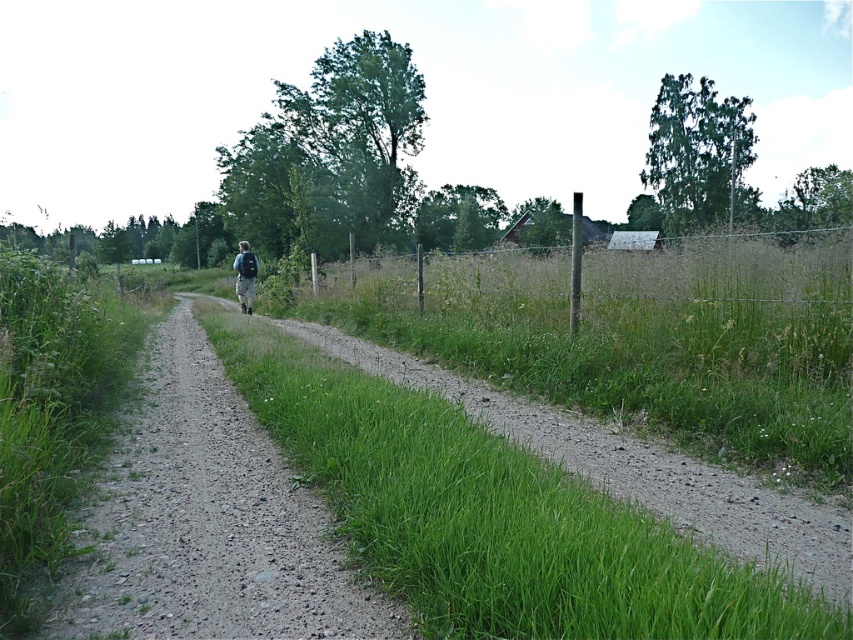
Measure the distance between green wire fence at center and blue backpack at center.

They are 26.31 feet apart.

Is green wire fence at center above blue backpack at center?

Actually, green wire fence at center is below blue backpack at center.

The height and width of the screenshot is (640, 853). What do you see at coordinates (722, 288) in the screenshot?
I see `green wire fence at center` at bounding box center [722, 288].

Locate an element on the screen. green wire fence at center is located at coordinates (722, 288).

Is dirt/gravel path at center to the left of blue backpack at center from the viewer's perspective?

No, dirt/gravel path at center is not to the left of blue backpack at center.

Consider the image. Between dirt/gravel path at center and blue backpack at center, which one has less height?

dirt/gravel path at center is shorter.

Between point (178, 312) and point (244, 312), which one is positioned behind?

Point (178, 312)

The width and height of the screenshot is (853, 640). I want to click on dirt/gravel path at center, so click(x=207, y=522).

Can you confirm if dirt/gravel path at center is bigger than green wire fence at center?

Incorrect, dirt/gravel path at center is not larger than green wire fence at center.

Is dirt/gravel path at center smaller than green wire fence at center?

Correct, dirt/gravel path at center occupies less space than green wire fence at center.

Does point (235, 634) come behind point (495, 289)?

No, it is in front of (495, 289).

Locate an element on the screen. dirt/gravel path at center is located at coordinates (207, 522).